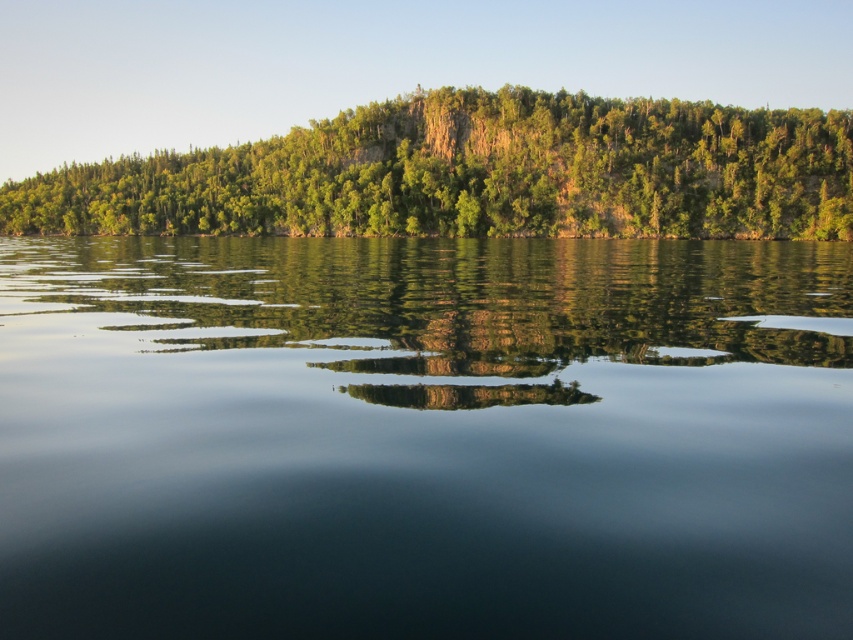
Question: Where is green reflective water at center located in relation to green leafy trees at upper center in the image?

Choices:
 (A) right
 (B) left

Answer: (A)

Question: Which point is closer to the camera taking this photo?

Choices:
 (A) (424, 188)
 (B) (318, 468)

Answer: (B)

Question: Is green reflective water at center in front of green leafy trees at upper center?

Choices:
 (A) yes
 (B) no

Answer: (A)

Question: Where is green reflective water at center located in relation to green leafy trees at upper center in the image?

Choices:
 (A) below
 (B) above

Answer: (A)